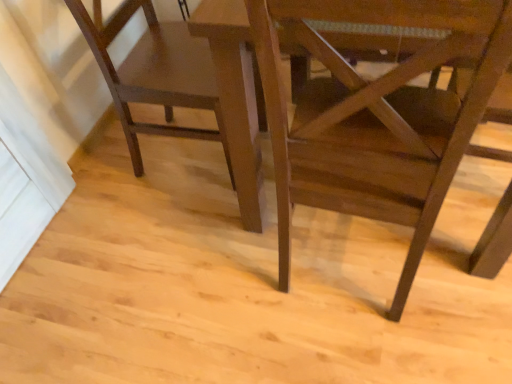
Question: Looking at their shapes, would you say matte brown chair at left, arranged as the 2th chair when viewed from the right, is wider or thinner than matte brown chair at lower right, positioned as the 2th chair in left-to-right order?

Choices:
 (A) wide
 (B) thin

Answer: (A)

Question: Is matte brown chair at left, arranged as the 2th chair when viewed from the right, situated inside matte brown chair at lower right, positioned as the 2th chair in left-to-right order, or outside?

Choices:
 (A) inside
 (B) outside

Answer: (B)

Question: Considering the positions of point (173, 46) and point (313, 122), is point (173, 46) closer or farther from the camera than point (313, 122)?

Choices:
 (A) closer
 (B) farther

Answer: (B)

Question: From a real-world perspective, relative to matte brown chair at left, arranged as the 2th chair when viewed from the right, is matte brown chair at lower right, the 1th chair from the right, vertically above or below?

Choices:
 (A) below
 (B) above

Answer: (B)

Question: From the image's perspective, is matte brown chair at lower right, positioned as the 2th chair in left-to-right order, above or below matte brown chair at left, the 1th chair viewed from the left?

Choices:
 (A) below
 (B) above

Answer: (A)

Question: Is matte brown chair at lower right, the 1th chair from the right, wider or thinner than matte brown chair at left, the 1th chair viewed from the left?

Choices:
 (A) thin
 (B) wide

Answer: (A)

Question: Is matte brown chair at lower right, the 1th chair from the right, inside or outside of matte brown chair at left, the 1th chair viewed from the left?

Choices:
 (A) inside
 (B) outside

Answer: (B)